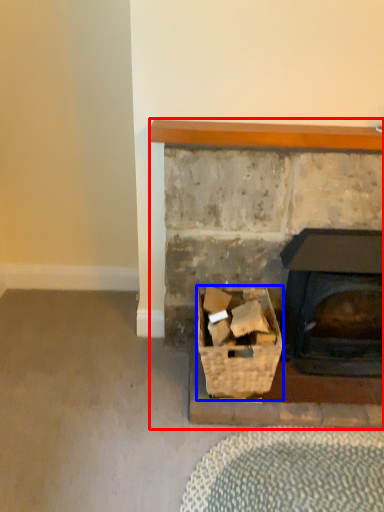
Question: Which object is closer to the camera taking this photo, fireplace (highlighted by a red box) or basket (highlighted by a blue box)?

Choices:
 (A) fireplace
 (B) basket

Answer: (B)